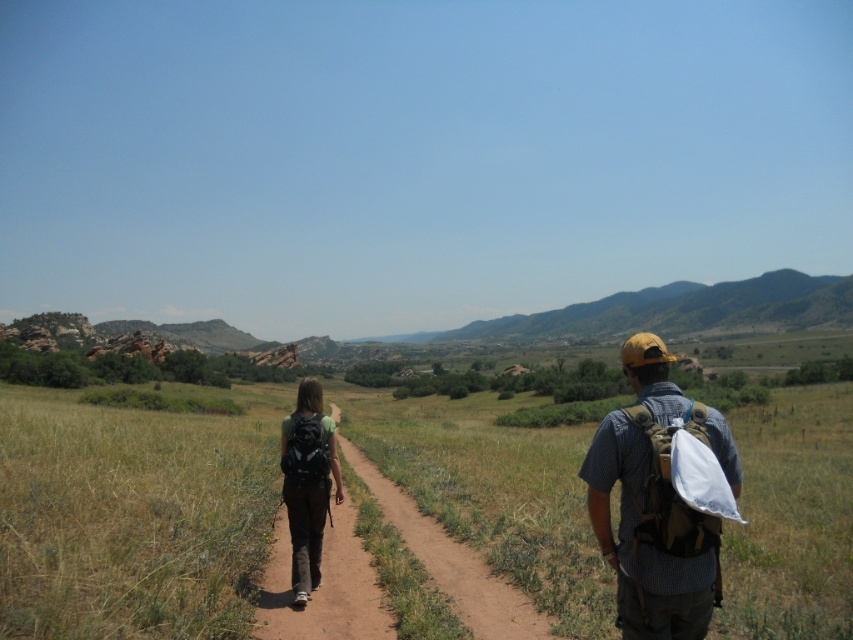
In the scene shown: You are a hiker planning to walk along the path between the green grassy at center and the matte black backpack at center. Which direction should you walk to avoid stepping on the grass?

The green grassy at center is on the right side of the matte black backpack at center, so to avoid stepping on the grass, you should walk to the left side of the matte black backpack at center.

You are a drone operator trying to capture a photo of two points on the hiking path. The first point is at coordinate point (801, 502) and the second is at point (297, 444). Which point is closer to the camera so that you can focus better?

Point (801, 502) is closer to the camera than point (297, 444), so you should focus on that point first.

You are a hiker who wants to know the location of the green grassy area in the image. What are the coordinates of the green grassy at center?

The coordinates of the green grassy at center are at point (131, 516).